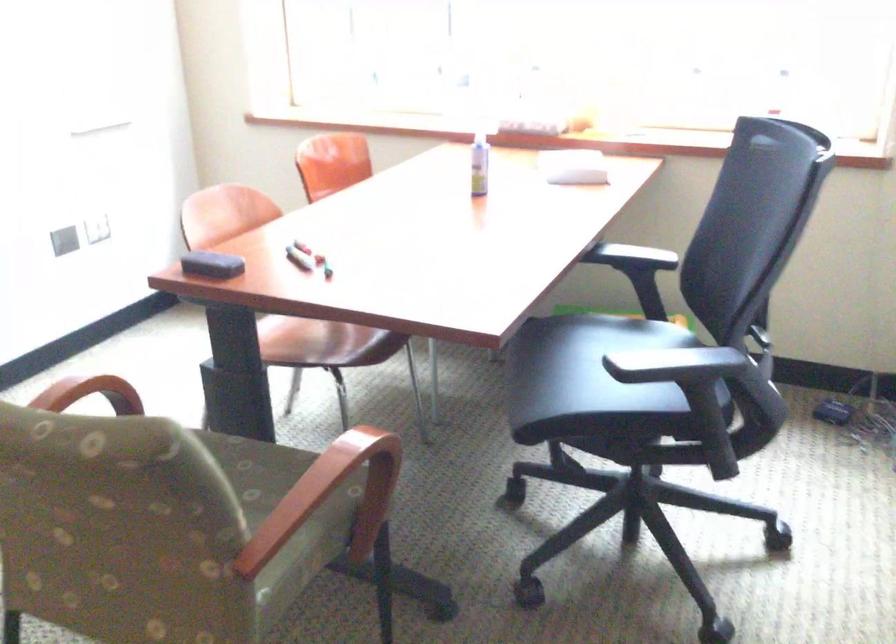
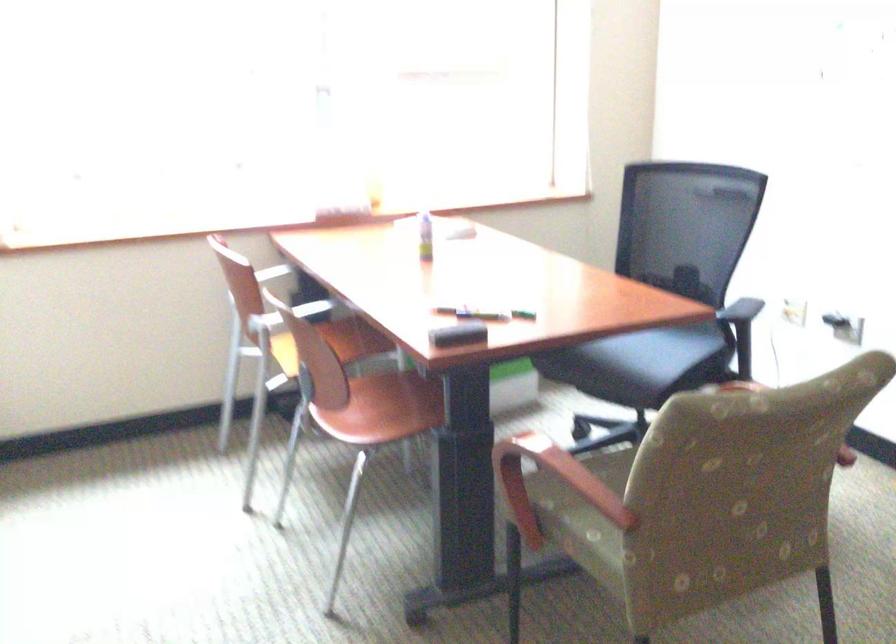
In the second image, find the point that corresponds to the point at 480,172 in the first image.

(425, 236)